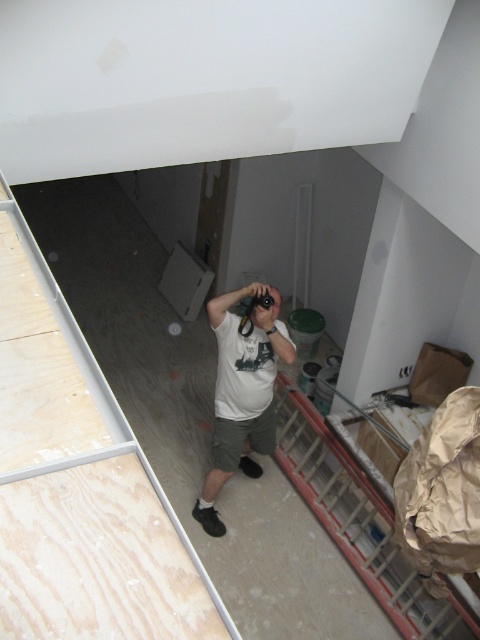
Question: Which point appears farthest from the camera in this image?

Choices:
 (A) (260, 342)
 (B) (312, 460)

Answer: (B)

Question: Is metallic red ladder at lower right below white matte t-shirt at center?

Choices:
 (A) no
 (B) yes

Answer: (B)

Question: From the image, what is the correct spatial relationship of metallic red ladder at lower right in relation to white matte t-shirt at center?

Choices:
 (A) above
 (B) below

Answer: (B)

Question: Is metallic red ladder at lower right to the left of white matte t-shirt at center from the viewer's perspective?

Choices:
 (A) yes
 (B) no

Answer: (B)

Question: Among these points, which one is farthest from the camera?

Choices:
 (A) (240, 461)
 (B) (288, 472)

Answer: (A)